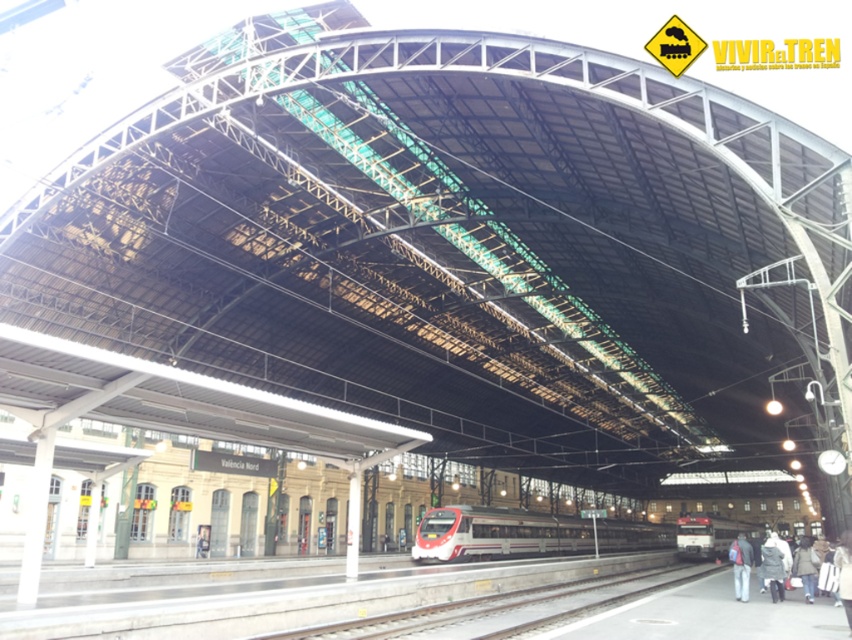
Question: Can you confirm if smooth concrete train track at center is thinner than light brown leather jacket at lower right?

Choices:
 (A) yes
 (B) no

Answer: (B)

Question: Among these objects, which one is nearest to the camera?

Choices:
 (A) white glossy train at center
 (B) white fuzzy coat at lower right
 (C) smooth concrete train track at center
 (D) red metallic train at center

Answer: (C)

Question: Which of the following is the farthest from the observer?

Choices:
 (A) white fuzzy coat at lower right
 (B) smooth concrete train track at center
 (C) red metallic train at center

Answer: (C)

Question: Estimate the real-world distances between objects in this image. Which object is farther from the white fuzzy coat at lower right?

Choices:
 (A) dark gray jacket at lower right
 (B) smooth concrete train track at center
 (C) white glossy train at center

Answer: (C)

Question: Can you confirm if smooth concrete train track at center is positioned below light brown leather jacket at lower right?

Choices:
 (A) no
 (B) yes

Answer: (B)

Question: Is smooth concrete train track at center wider than white glossy train at center?

Choices:
 (A) yes
 (B) no

Answer: (B)